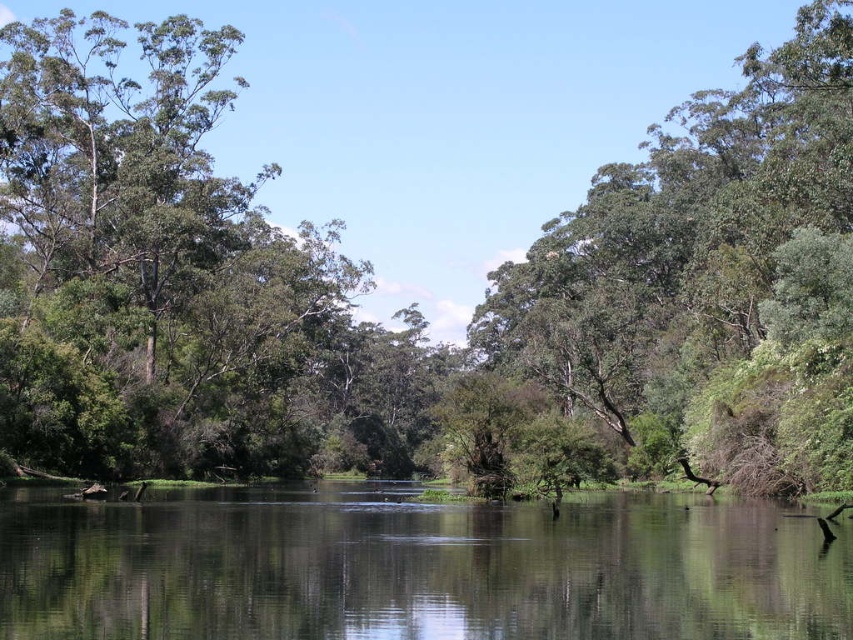
Is clear water at center thinner than green leafy tree at center?

Yes.

Between clear water at center and green leafy tree at center, which one has more height?

With more height is green leafy tree at center.

Between point (262, 628) and point (828, 237), which one is positioned in front?

Point (262, 628) is more forward.

Locate an element on the screen. Image resolution: width=853 pixels, height=640 pixels. clear water at center is located at coordinates (416, 570).

Between green leafy tree at left and clear water at center, which one is positioned lower?

clear water at center

Can you confirm if green leafy tree at left is thinner than clear water at center?

Incorrect, green leafy tree at left's width is not less than clear water at center's.

Is point (250, 432) closer to viewer compared to point (152, 620)?

No, it is not.

The height and width of the screenshot is (640, 853). I want to click on green leafy tree at left, so click(x=158, y=269).

Is green leafy tree at left taller than green leafy tree at center?

Indeed, green leafy tree at left has a greater height compared to green leafy tree at center.

Find the location of `green leafy tree at left`. green leafy tree at left is located at coordinates (158, 269).

Does point (67, 68) come closer to viewer compared to point (570, 333)?

That is True.

This screenshot has height=640, width=853. What are the coordinates of `green leafy tree at left` in the screenshot? It's located at (158, 269).